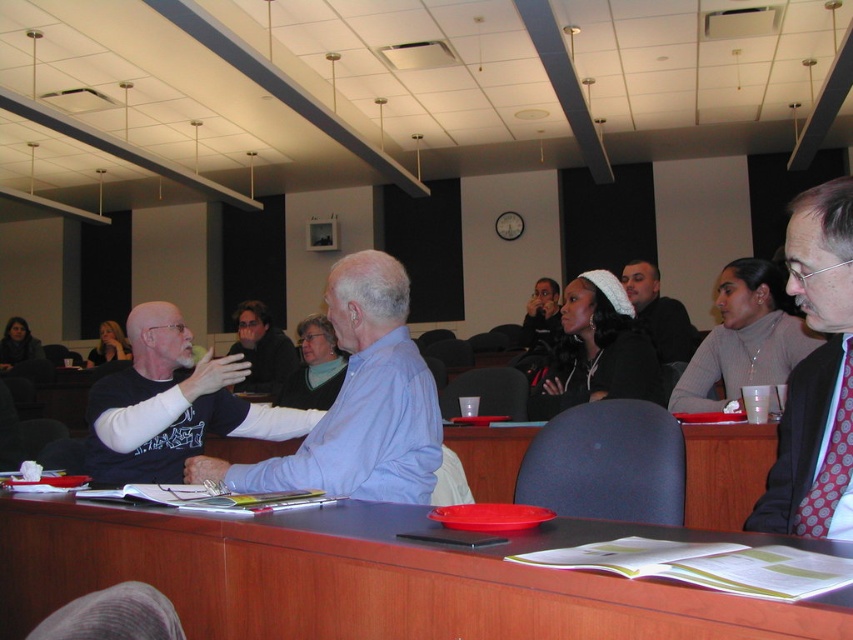
Question: Which is farther from the blue shirt at center?

Choices:
 (A) matte black shirt at center
 (B) black matte shirt at left

Answer: (A)

Question: Which object is closer to the camera taking this photo?

Choices:
 (A) matte black shirt at center
 (B) red dotted tie at right
 (C) dark brown hair at center
 (D) brown wood table at center

Answer: (D)

Question: Does white knit hat at center appear under dark brown hair at center?

Choices:
 (A) no
 (B) yes

Answer: (B)

Question: Can you confirm if black matte shirt at left is bigger than red dotted tie at right?

Choices:
 (A) yes
 (B) no

Answer: (A)

Question: Considering the real-world distances, which object is closest to the matte black shirt at center?

Choices:
 (A) polka dot tie at right
 (B) brown wood table at center
 (C) white knit hat at center
 (D) dark brown hair at center

Answer: (C)

Question: Is brown wood table at center wider than dark brown hair at center?

Choices:
 (A) yes
 (B) no

Answer: (A)